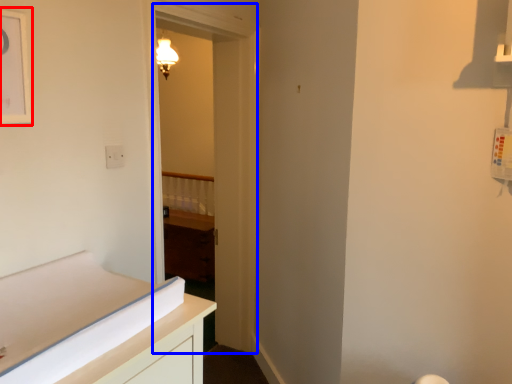
Question: Which object is further to the camera taking this photo, picture frame (highlighted by a red box) or door (highlighted by a blue box)?

Choices:
 (A) picture frame
 (B) door

Answer: (B)